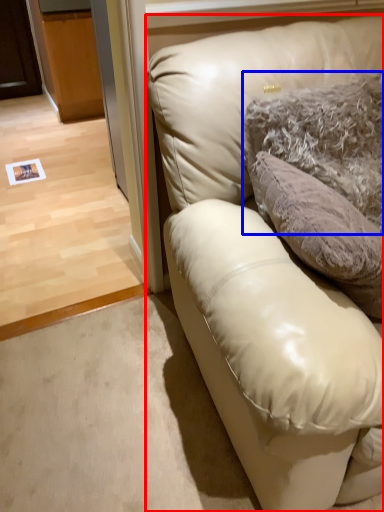
Question: Which object appears closest to the camera in this image, studio couch (highlighted by a red box) or pillow (highlighted by a blue box)?

Choices:
 (A) studio couch
 (B) pillow

Answer: (A)